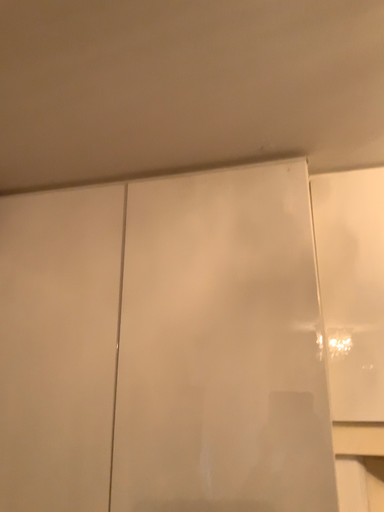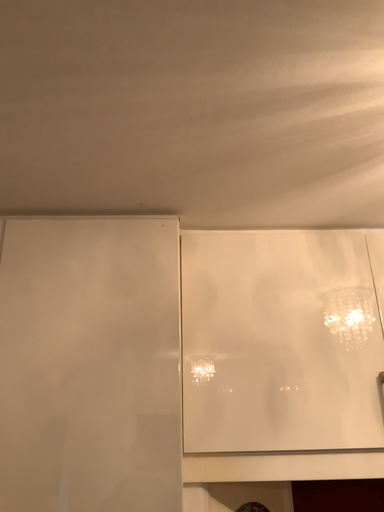
Question: How did the camera likely rotate when shooting the video?

Choices:
 (A) rotated left
 (B) rotated right

Answer: (B)